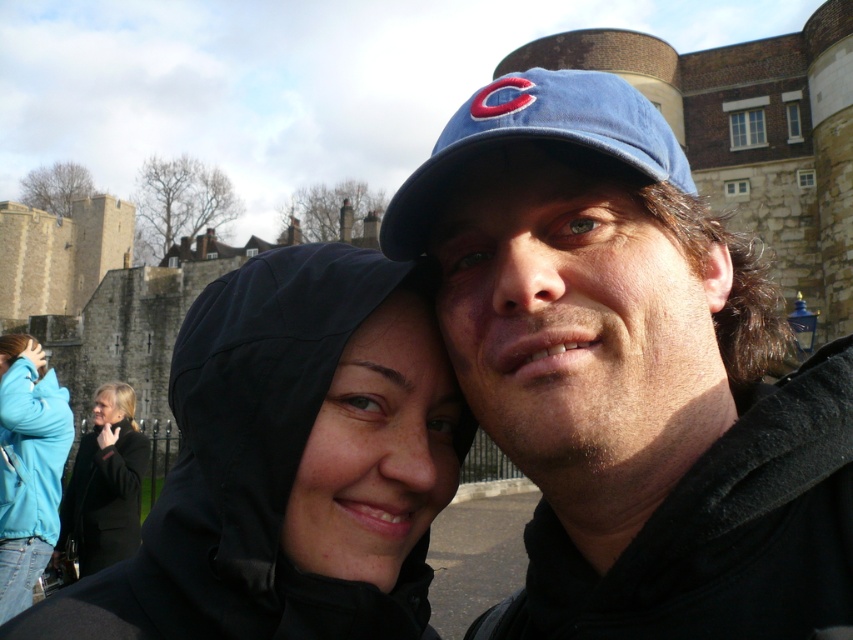
You are a photographer trying to capture a group photo of the matte black hoodie at center and the turquoise fleece jacket at lower left. If you want to ensure both subjects are fully visible in the frame, which one should you position closer to the camera to avoid cropping?

The matte black hoodie at center should be positioned closer to the camera because its width is smaller than the turquoise fleece jacket at lower left, allowing it to fit better in the frame without cropping.